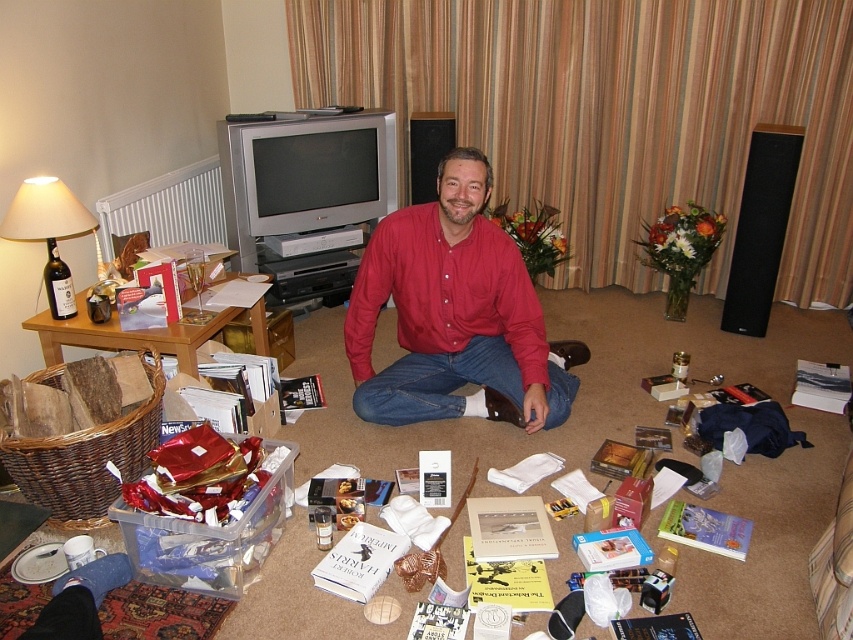
You are a delivery robot that needs to place a package between the red cotton shirt at center and the matte beige lampshade at left. The package requires 1 meter of space. Can you fit it there?

The red cotton shirt at center and the matte beige lampshade at left are 1.16 meters apart from each other. Since the required space is 1 meter, the package can fit between them.

You are a photographer trying to capture the man in the red cotton shirt at center. You want to ensure the matte beige lampshade at left is visible in the background. Is the current arrangement suitable for this shot?

Yes, the current arrangement is suitable because the red cotton shirt at center is located below the matte beige lampshade at left, so the lampshade would naturally appear in the background of the photo.